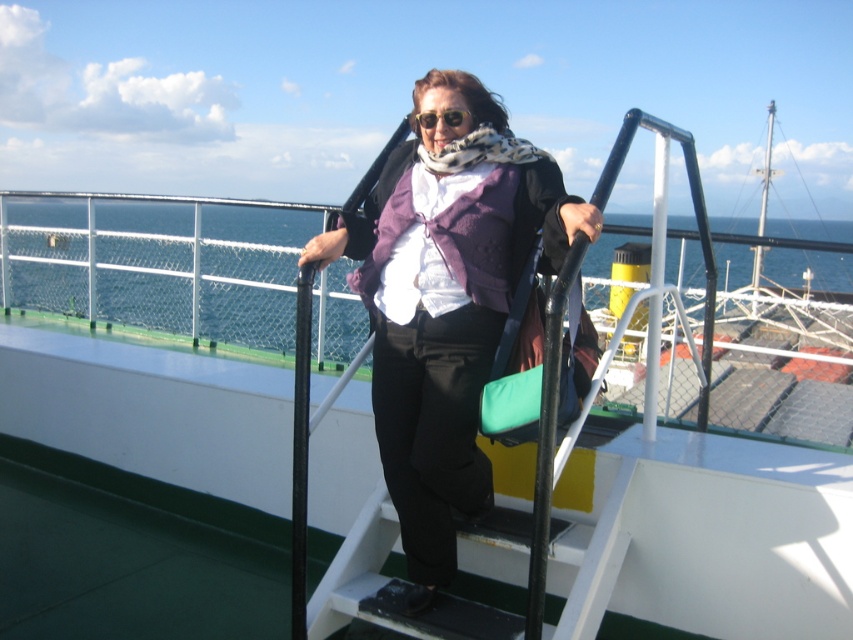
Is point (451, 467) positioned behind point (457, 124)?

No, (451, 467) is in front of (457, 124).

Between point (550, 172) and point (445, 116), which one is positioned behind?

The point (550, 172) is behind.

Is point (490, 298) farther from viewer compared to point (454, 120)?

No, it is not.

Locate an element on the screen. Image resolution: width=853 pixels, height=640 pixels. purple woolen vest at center is located at coordinates (445, 301).

From the picture: Which is below, blue water at upper center or matte black sunglasses at center?

Positioned lower is matte black sunglasses at center.

Between point (231, 262) and point (445, 115), which one is positioned behind?

Point (231, 262)

Is point (16, 296) positioned behind point (436, 120)?

Yes, point (16, 296) is farther from viewer.

This screenshot has width=853, height=640. Find the location of `blue water at upper center`. blue water at upper center is located at coordinates (157, 264).

From the picture: Does purple woolen vest at center have a greater width compared to blue water at upper center?

No.

Is purple woolen vest at center positioned behind blue water at upper center?

No.

Describe the element at coordinates (445, 301) in the screenshot. I see `purple woolen vest at center` at that location.

You are a GUI agent. You are given a task and a screenshot of the screen. Output one action in this format:
    pyautogui.click(x=<x>, y=<y>)
    Task: Click on the purple woolen vest at center
    The width and height of the screenshot is (853, 640).
    Given the screenshot: What is the action you would take?
    pyautogui.click(x=445, y=301)